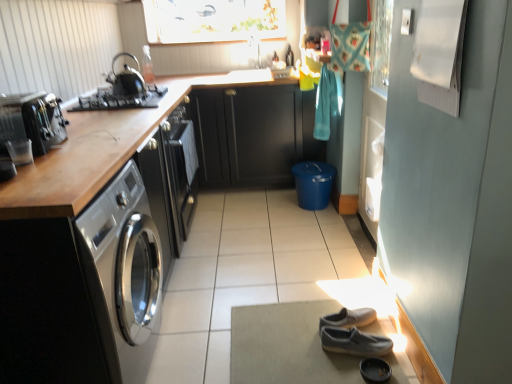
Question: Is black matte gas stove at upper left at the left side of matte glass window screen at upper center?

Choices:
 (A) yes
 (B) no

Answer: (A)

Question: Can you confirm if black matte gas stove at upper left is wider than matte glass window screen at upper center?

Choices:
 (A) no
 (B) yes

Answer: (B)

Question: From a real-world perspective, is black matte gas stove at upper left physically above matte glass window screen at upper center?

Choices:
 (A) no
 (B) yes

Answer: (A)

Question: Is black matte gas stove at upper left next to matte glass window screen at upper center and touching it?

Choices:
 (A) no
 (B) yes

Answer: (A)

Question: Would you say black matte gas stove at upper left contains matte glass window screen at upper center?

Choices:
 (A) no
 (B) yes

Answer: (A)

Question: From the image's perspective, is shiny black kettle at upper left above or below satin black toaster at left?

Choices:
 (A) above
 (B) below

Answer: (A)

Question: Is point (113, 74) closer or farther from the camera than point (38, 119)?

Choices:
 (A) farther
 (B) closer

Answer: (A)

Question: Would you say shiny black kettle at upper left is inside or outside satin black toaster at left?

Choices:
 (A) outside
 (B) inside

Answer: (A)

Question: From a real-world perspective, is shiny black kettle at upper left physically located above or below satin black toaster at left?

Choices:
 (A) below
 (B) above

Answer: (B)

Question: From the image's perspective, relative to sleek stainless steel washing machine at left, is black leather shoe at lower center above or below?

Choices:
 (A) above
 (B) below

Answer: (B)

Question: Does point (373, 372) appear closer or farther from the camera than point (135, 238)?

Choices:
 (A) farther
 (B) closer

Answer: (A)

Question: Is black leather shoe at lower center bigger or smaller than sleek stainless steel washing machine at left?

Choices:
 (A) small
 (B) big

Answer: (A)

Question: In terms of width, does black leather shoe at lower center look wider or thinner when compared to sleek stainless steel washing machine at left?

Choices:
 (A) wide
 (B) thin

Answer: (B)

Question: Considering the positions of point (49, 94) and point (312, 332), is point (49, 94) closer or farther from the camera than point (312, 332)?

Choices:
 (A) closer
 (B) farther

Answer: (A)

Question: Based on their sizes in the image, would you say satin black toaster at left is bigger or smaller than gray suede shoes at lower center?

Choices:
 (A) small
 (B) big

Answer: (A)